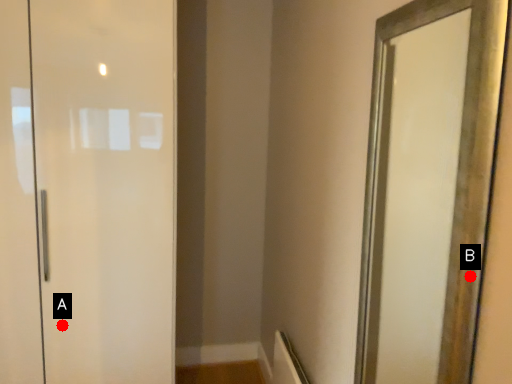
Question: Two points are circled on the image, labeled by A and B beside each circle. Which of the following is the farthest from the observer?

Choices:
 (A) A is further
 (B) B is further

Answer: (A)